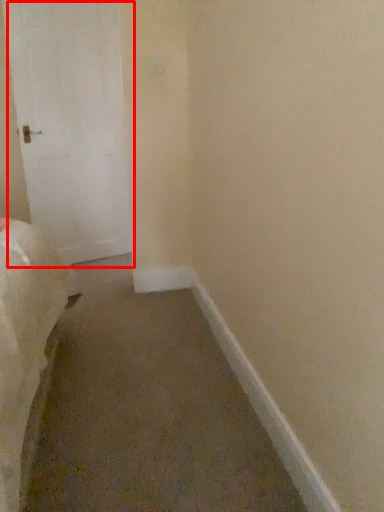
Question: From the image's perspective, where is door (annotated by the red box) located relative to molding?

Choices:
 (A) above
 (B) below

Answer: (A)